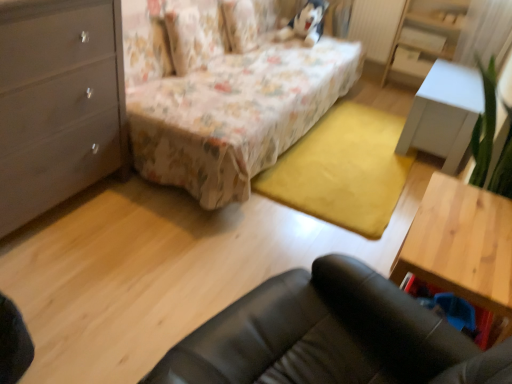
Question: Is white glossy table at right, the second table in the bottom-to-top sequence, in front of or behind floral fabric pillow at upper center in the image?

Choices:
 (A) behind
 (B) front

Answer: (A)

Question: Is white glossy table at right, marked as the 2th table in a front-to-back arrangement, bigger or smaller than floral fabric pillow at upper center?

Choices:
 (A) small
 (B) big

Answer: (B)

Question: Estimate the real-world distances between objects in this image. Which object is farther from the floral fabric bed at center?

Choices:
 (A) matte gray dresser at left
 (B) white matte drawer at upper right
 (C) white glossy table at right, the second table in the bottom-to-top sequence
 (D) white glossy dresser at upper right
 (E) floral fabric pillow at upper center

Answer: (B)

Question: Estimate the real-world distances between objects in this image. Which object is closer to the white matte drawer at upper right?

Choices:
 (A) matte gray dresser at left
 (B) white sheer curtain at upper right
 (C) white glossy table at right, placed as the 1th table when sorted from top to bottom
 (D) floral fabric pillow at upper center
 (E) wooden table at lower right, which is the 1th table in bottom-to-top order

Answer: (B)